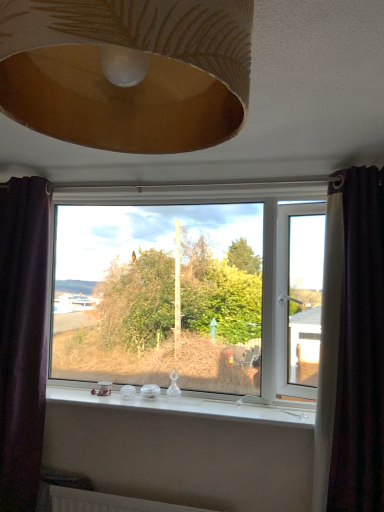
Where is `free space above white glossy window sill at center (from a real-world perspective)`? This screenshot has height=512, width=384. free space above white glossy window sill at center (from a real-world perspective) is located at coordinates (173, 404).